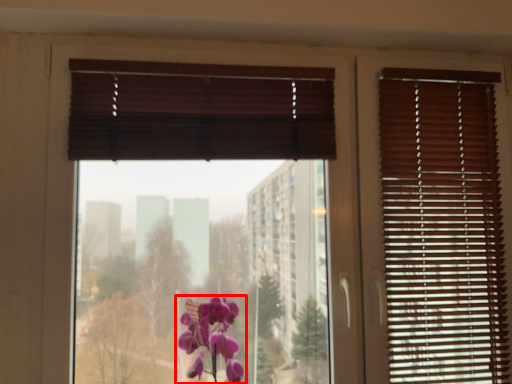
Question: From the image, what is the correct spatial relationship of flower (annotated by the red box) in relation to window screen?

Choices:
 (A) right
 (B) left

Answer: (A)